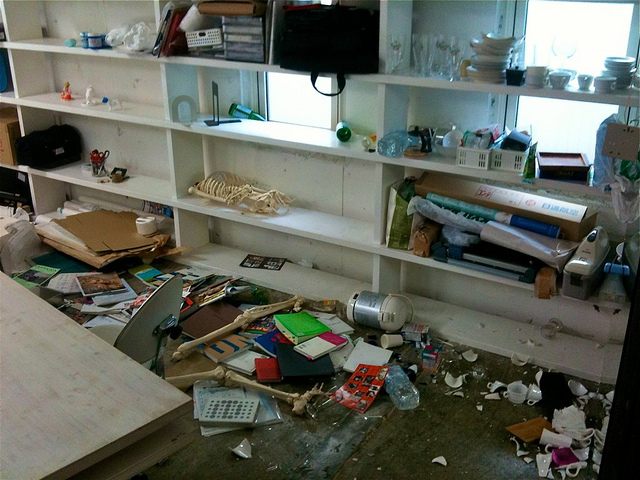
You are a GUI agent. You are given a task and a screenshot of the screen. Output one action in this format:
    pyautogui.click(x=<x>, y=<y>)
    Task: Click on the trash scattered on the floor
    Image resolution: width=640 pixels, height=480 pixels.
    Given the screenshot: What is the action you would take?
    pyautogui.click(x=461, y=355), pyautogui.click(x=461, y=374), pyautogui.click(x=492, y=377), pyautogui.click(x=512, y=380), pyautogui.click(x=563, y=398), pyautogui.click(x=564, y=434), pyautogui.click(x=555, y=444)